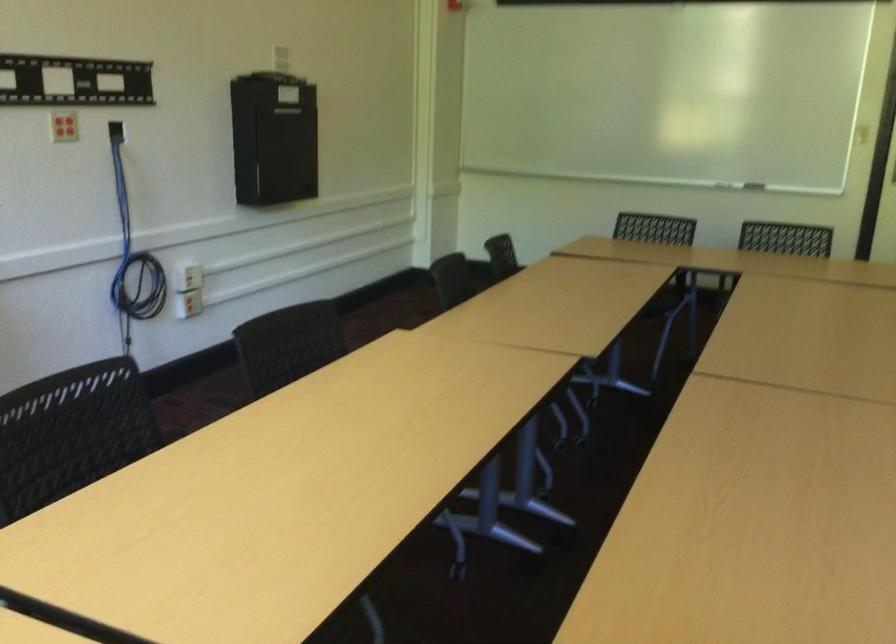
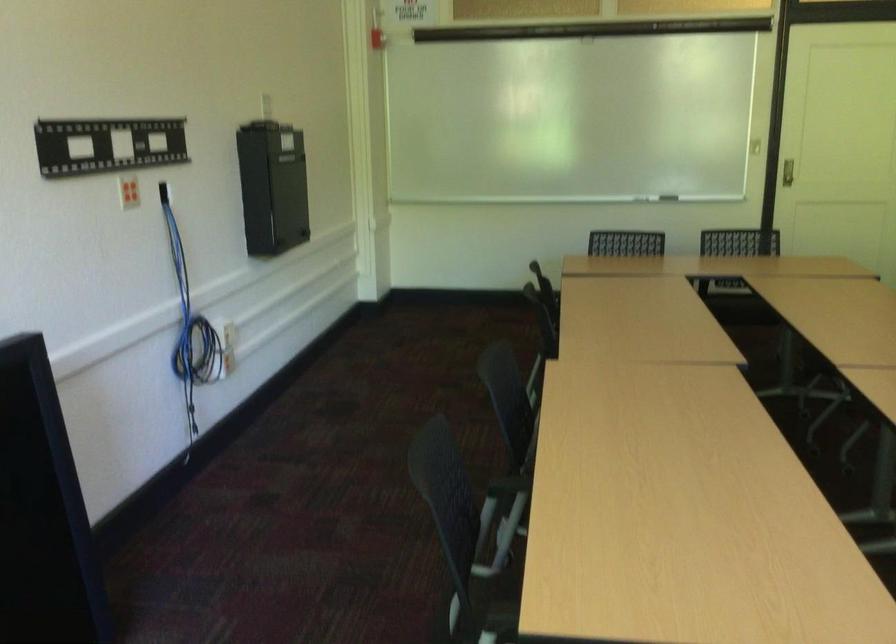
Question: Which direction would the cameraman need to move to produce the second image? Reply with the corresponding letter.

Choices:
 (A) Left
 (B) Right
 (C) Forward
 (D) Backward

Answer: (A)